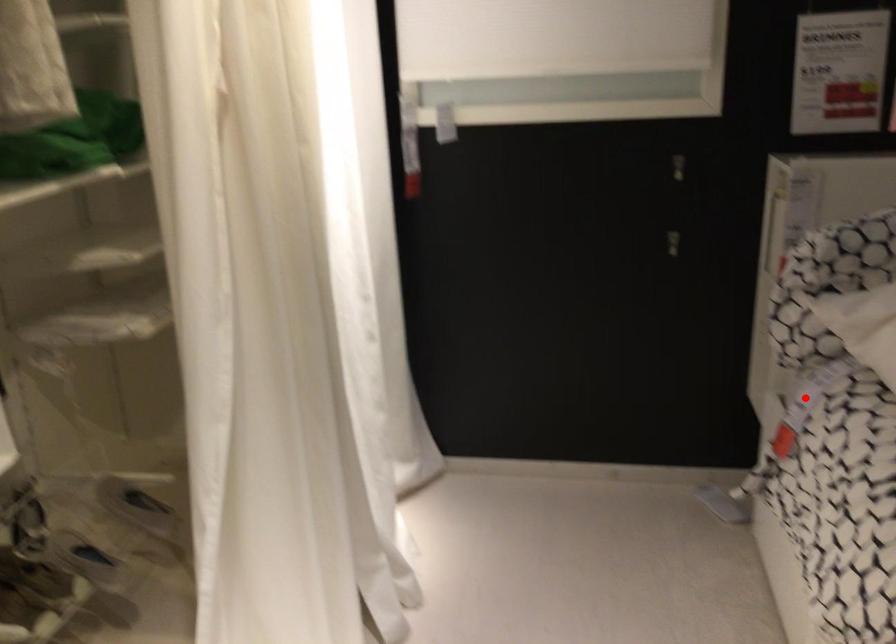
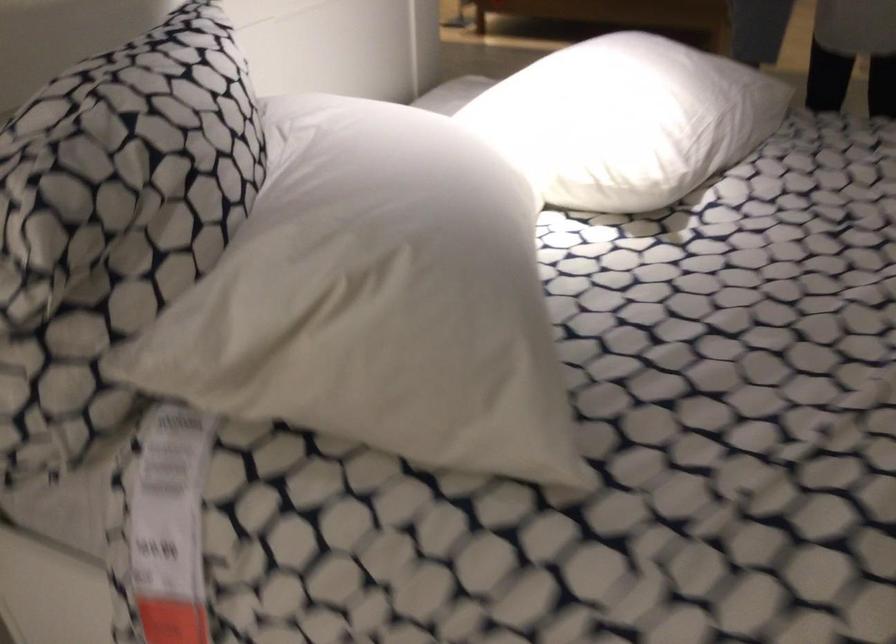
Question: I am providing you with two images of the same scene from different viewpoints. In image1, a red point is highlighted. Considering the same 3D point in image2, which of the following is correct?

Choices:
 (A) It is closer
 (B) It is farther

Answer: (A)